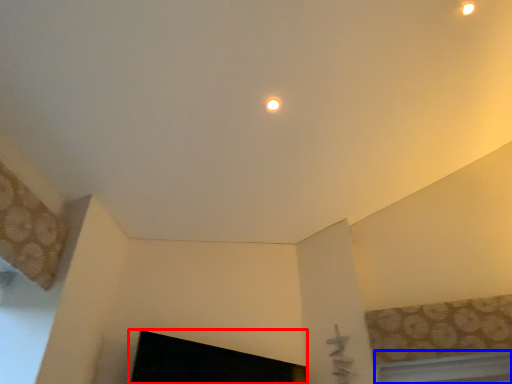
Question: Which object appears closest to the camera in this image, fireplace (highlighted by a red box) or window (highlighted by a blue box)?

Choices:
 (A) fireplace
 (B) window

Answer: (A)